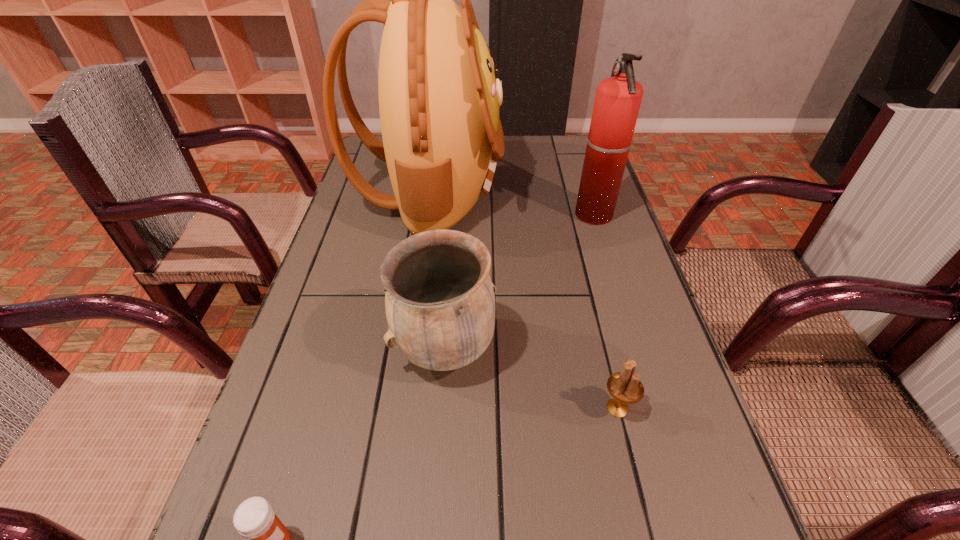
Where is `the tallest object`? The image size is (960, 540). the tallest object is located at coordinates click(439, 97).

Locate an element on the screen. Image resolution: width=960 pixels, height=540 pixels. fire extinguisher is located at coordinates (617, 102).

This screenshot has width=960, height=540. Find the location of `the third tallest object`. the third tallest object is located at coordinates (439, 298).

Where is `the third nearest object`? This screenshot has width=960, height=540. the third nearest object is located at coordinates (439, 298).

Locate an element on the screen. The width and height of the screenshot is (960, 540). the fourth farthest object is located at coordinates (625, 387).

Locate an element on the screen. the fourth tallest object is located at coordinates (625, 387).

The height and width of the screenshot is (540, 960). Identify the location of free region located 0.260m on the front-facing side of the tallest object. (595, 191).

This screenshot has width=960, height=540. Identify the location of free region located with the nozzle and gauge on the fire extinguisher. (552, 215).

This screenshot has height=540, width=960. Find the location of `vacant point located 0.200m with the nozzle and gauge on the fire extinguisher`. vacant point located 0.200m with the nozzle and gauge on the fire extinguisher is located at coordinates (498, 215).

Find the location of `free location located 0.050m with the nozzle and gauge on the fire extinguisher`. free location located 0.050m with the nozzle and gauge on the fire extinguisher is located at coordinates click(x=556, y=215).